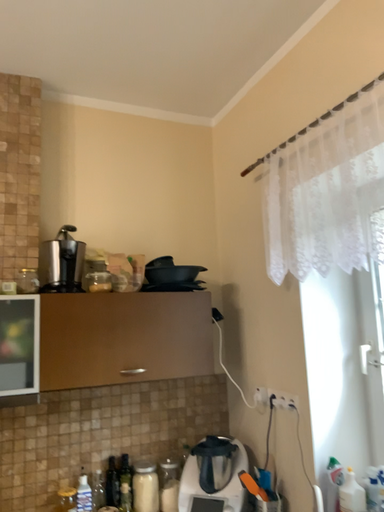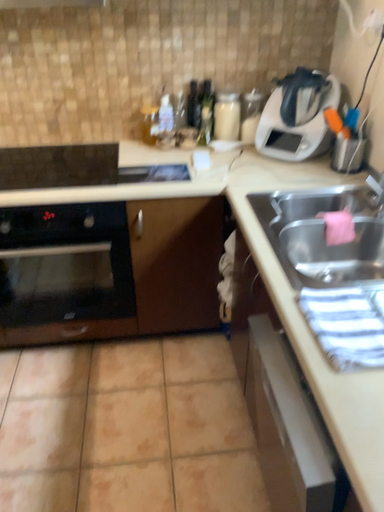
Question: Which way did the camera rotate in the video?

Choices:
 (A) rotated right
 (B) rotated left

Answer: (B)